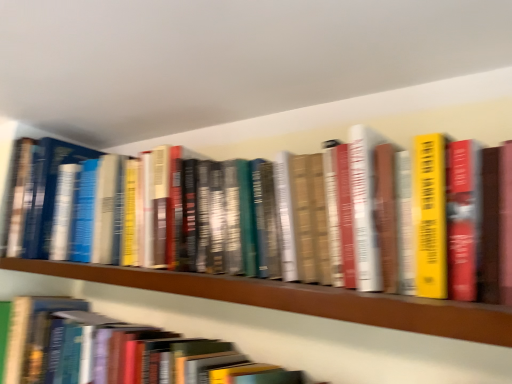
Question: Is hardcover book at lower left located outside wooden shelf at center?

Choices:
 (A) yes
 (B) no

Answer: (A)

Question: From a real-world perspective, is hardcover book at lower left positioned over wooden shelf at center based on gravity?

Choices:
 (A) yes
 (B) no

Answer: (B)

Question: Is hardcover book at lower left oriented away from wooden shelf at center?

Choices:
 (A) no
 (B) yes

Answer: (A)

Question: From a real-world perspective, is hardcover book at lower left beneath wooden shelf at center?

Choices:
 (A) no
 (B) yes

Answer: (B)

Question: Is hardcover book at lower left to the right of wooden shelf at center from the viewer's perspective?

Choices:
 (A) no
 (B) yes

Answer: (A)

Question: Would you say wooden shelf at center is part of hardcover book at lower left's contents?

Choices:
 (A) no
 (B) yes

Answer: (A)

Question: Does wooden shelf at center have a smaller size compared to hardcover book at lower left?

Choices:
 (A) yes
 (B) no

Answer: (A)

Question: Does wooden shelf at center appear on the left side of hardcover book at lower left?

Choices:
 (A) no
 (B) yes

Answer: (A)

Question: Can you confirm if wooden shelf at center is wider than hardcover book at lower left?

Choices:
 (A) no
 (B) yes

Answer: (B)

Question: Considering the relative sizes of wooden shelf at center and hardcover book at lower left in the image provided, is wooden shelf at center shorter than hardcover book at lower left?

Choices:
 (A) yes
 (B) no

Answer: (A)

Question: Is wooden shelf at center next to hardcover book at lower left and touching it?

Choices:
 (A) no
 (B) yes

Answer: (A)

Question: Could you tell me if wooden shelf at center is turned towards hardcover book at lower left?

Choices:
 (A) no
 (B) yes

Answer: (A)

Question: Is point (166, 357) closer or farther from the camera than point (482, 324)?

Choices:
 (A) farther
 (B) closer

Answer: (A)